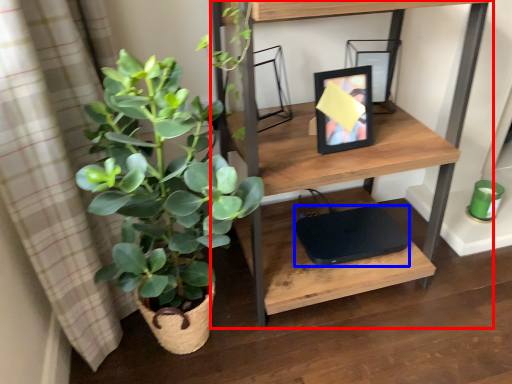
Question: Which object is closer to the camera taking this photo, shelf (highlighted by a red box) or computer (highlighted by a blue box)?

Choices:
 (A) shelf
 (B) computer

Answer: (A)